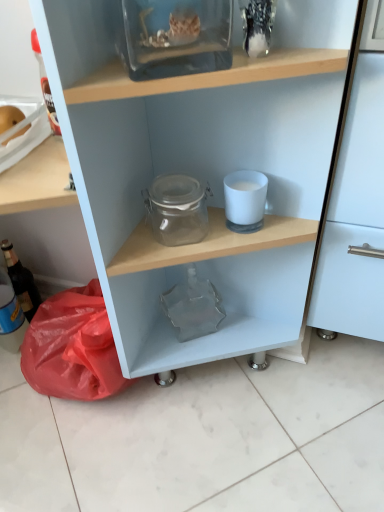
The image size is (384, 512). In order to click on free space in front of matte glass bottle at left in this screenshot , I will do `click(23, 393)`.